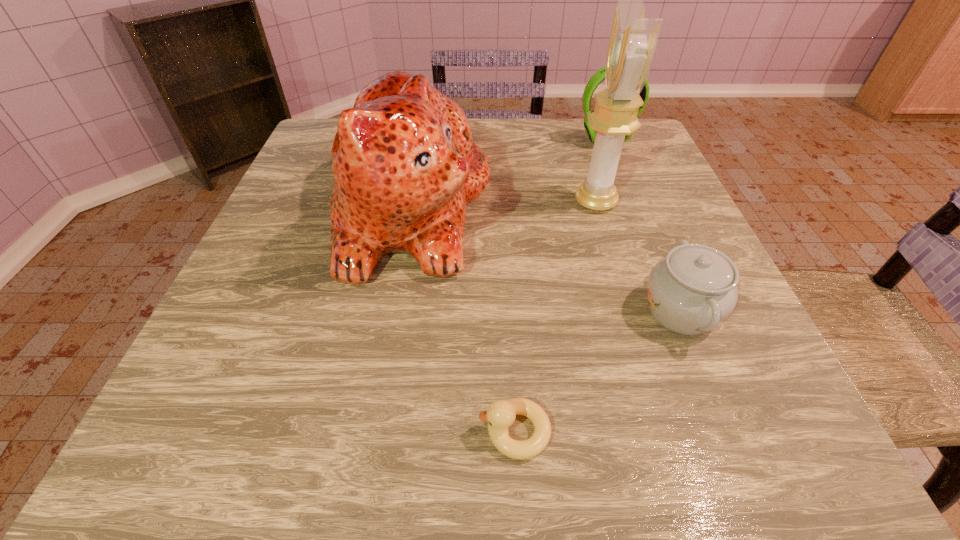
In order to click on vacant space that's between the second shortest object and the cat in this screenshot , I will do coord(546,259).

Image resolution: width=960 pixels, height=540 pixels. What are the coordinates of `vacant region between the shortest object and the third shortest object` in the screenshot? It's located at (560, 286).

The width and height of the screenshot is (960, 540). Find the location of `empty space that is in between the nearest object and the tallest object`. empty space that is in between the nearest object and the tallest object is located at coordinates (555, 316).

This screenshot has height=540, width=960. Identify the location of free space between the shortest object and the headset. (560, 286).

Locate an element on the screen. vacant space in between the duckling and the second shortest object is located at coordinates coord(597,371).

What are the coordinates of `free space between the second tallest object and the third tallest object` in the screenshot? It's located at (509, 174).

Point out which object is positioned as the nearest to the nearest object. Please provide its 2D coordinates. Your answer should be formatted as a tuple, i.e. [(x, y)], where the tuple contains the x and y coordinates of a point satisfying the conditions above.

[(692, 290)]

Locate which object is the third closest to the chinaware. Please provide its 2D coordinates. Your answer should be formatted as a tuple, i.e. [(x, y)], where the tuple contains the x and y coordinates of a point satisfying the conditions above.

[(405, 166)]

Find the location of a particular element. Image resolution: width=960 pixels, height=540 pixels. free space that satisfies the following two spatial constraints: 1. on the front side of the third tallest object; 2. at the beak of the duckling is located at coordinates (719, 431).

Find the location of `free location that satisfies the following two spatial constraints: 1. on the front side of the fourth tallest object; 2. on the right side of the headset`. free location that satisfies the following two spatial constraints: 1. on the front side of the fourth tallest object; 2. on the right side of the headset is located at coordinates (672, 311).